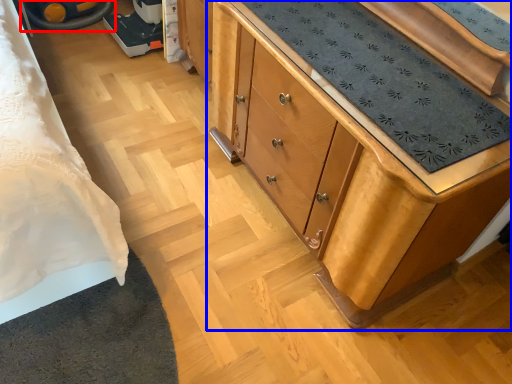
Question: Which object appears farthest to the camera in this image, wheel (highlighted by a red box) or chest of drawers (highlighted by a blue box)?

Choices:
 (A) wheel
 (B) chest of drawers

Answer: (A)